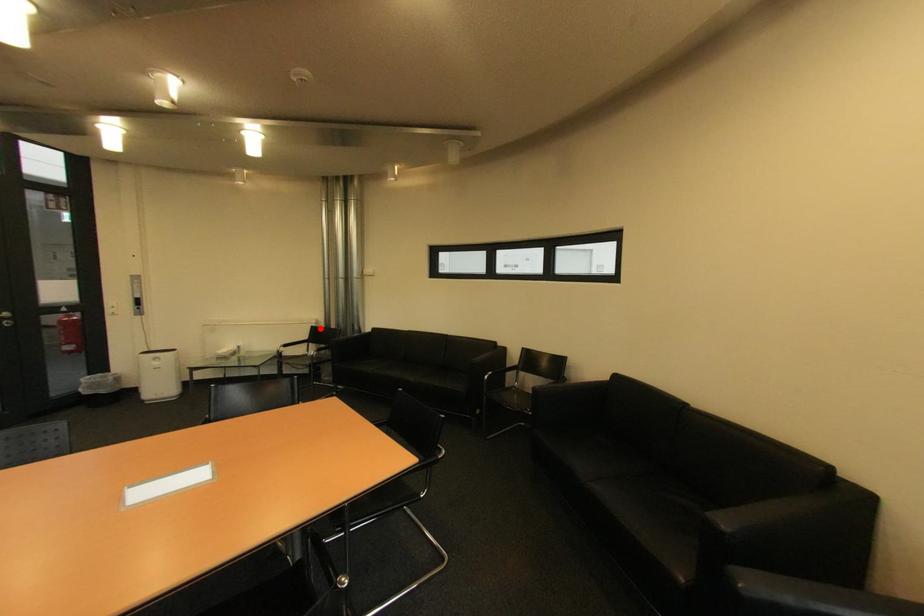
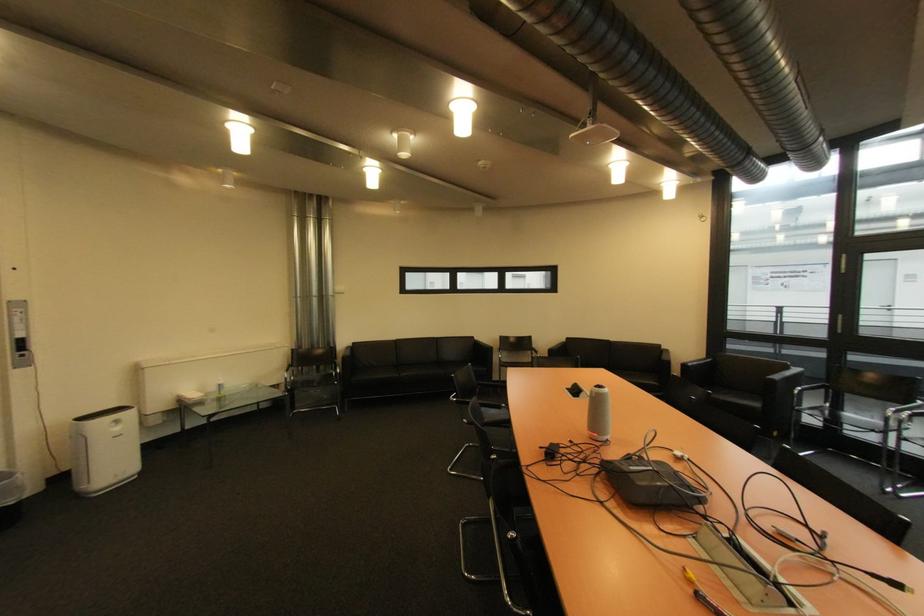
Where in the second image is the point corresponding to the highlighted location from the first image?

(301, 352)